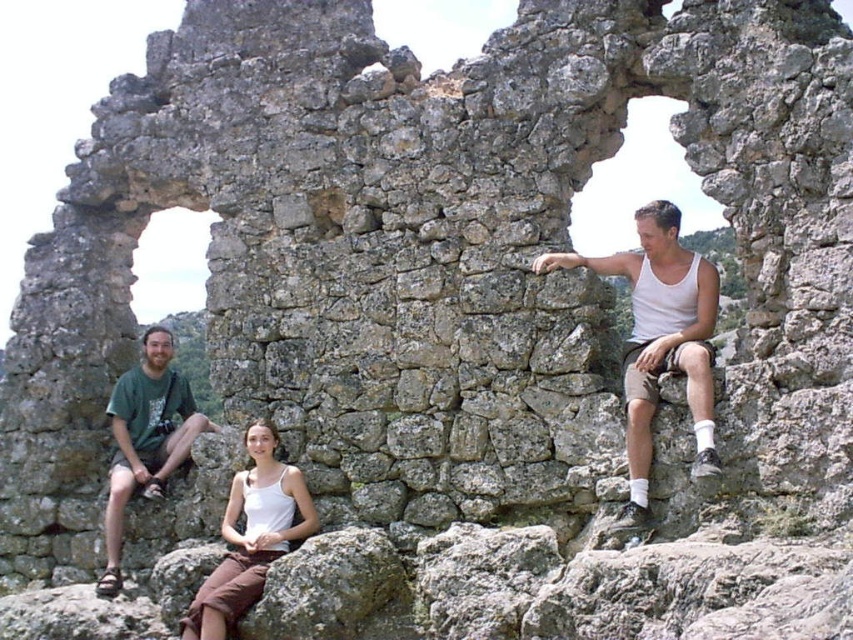
You are standing at the camera position and want to reach the point marked at coordinates (276, 545). The path is clear except for a small stream 30 meters from the camera. Can you safely walk to the point without crossing the stream?

The point marked at coordinates (276, 545) is 52.54 meters away from the camera. Since the stream is only 30 meters away, you can safely walk around it and continue to the point without crossing the water.